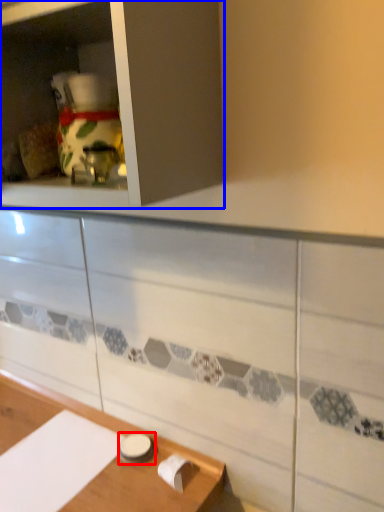
Question: Which of the following is the closest to the observer, tableware (highlighted by a red box) or cabinetry (highlighted by a blue box)?

Choices:
 (A) tableware
 (B) cabinetry

Answer: (B)